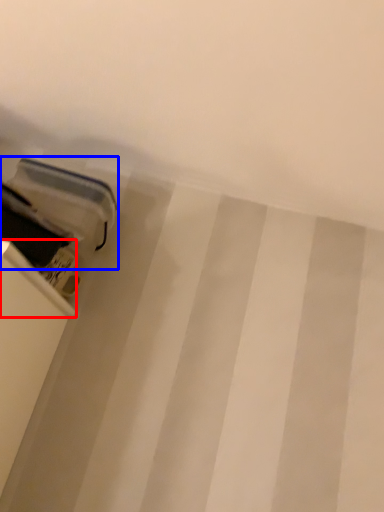
Question: Which object is closer to the camera taking this photo, shelf (highlighted by a red box) or equipment (highlighted by a blue box)?

Choices:
 (A) shelf
 (B) equipment

Answer: (A)